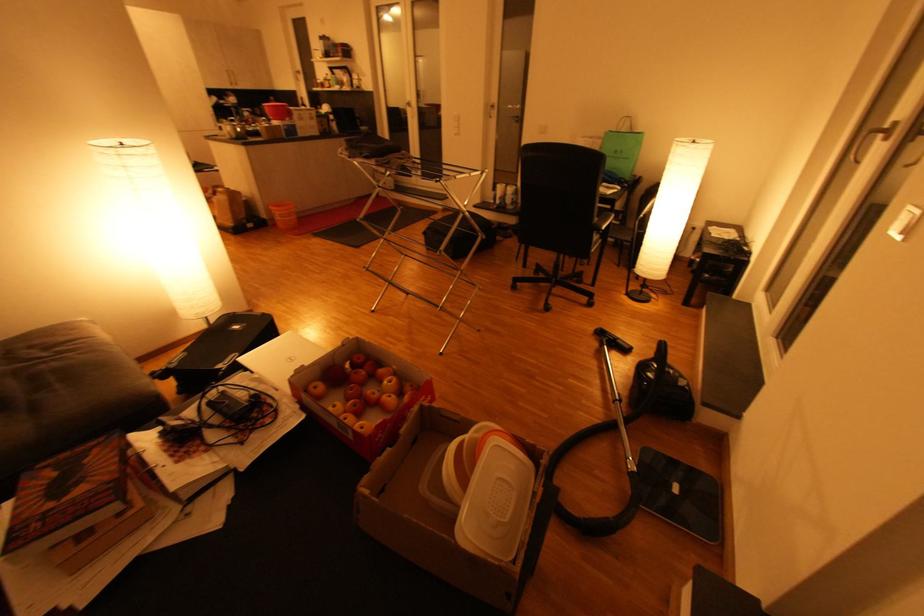
Describe the element at coordinates (561, 213) in the screenshot. Image resolution: width=924 pixels, height=616 pixels. I see `the chair armrest` at that location.